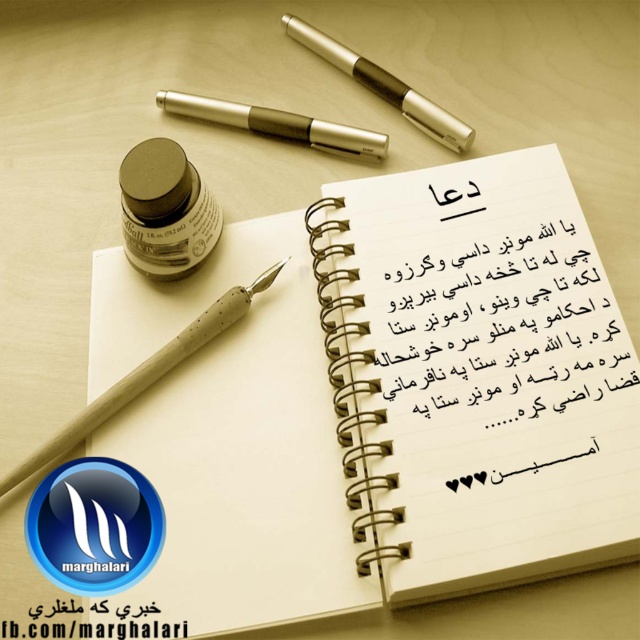
You are organizing a desk and see the matte black ink bottle at upper left and the matte wood pencil at left. Which object is positioned to the right of the other?

The matte black ink bottle at upper left is to the right of the matte wood pencil at left, so the ink bottle is positioned to the right of the pencil.

You are organizing your desk and need to place the matte wood pencil at left and the metallic pen at upper center. According to the image, which object is positioned to the left of the other?

The matte wood pencil at left is to the left of metallic pen at upper center, so the matte wood pencil at left is positioned to the left of the metallic pen at upper center.

You are organizing a desk and need to place a matte wood pencil at left and a metallic pen at upper center. Based on their positions, which object is nearer to you?

The matte wood pencil at left is closer to the viewer than the metallic pen at upper center.